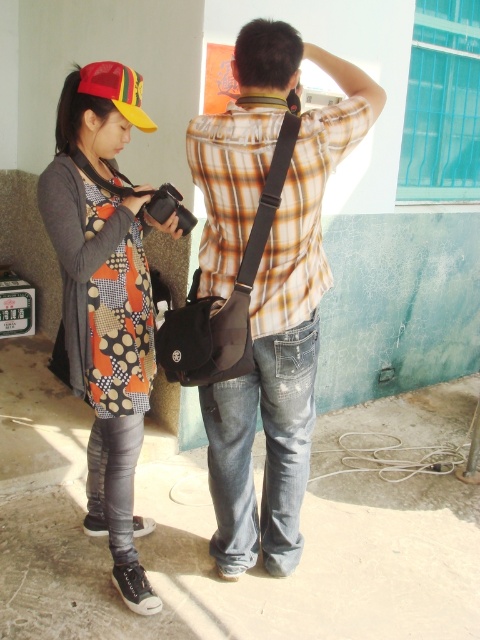
Question: Which object is the farthest from the matte patchwork dress at center?

Choices:
 (A) matte yellow baseball cap at upper left
 (B) plaid shirt at center

Answer: (A)

Question: Which is farther from the matte patchwork dress at center?

Choices:
 (A) matte yellow baseball cap at upper left
 (B) plaid shirt at center

Answer: (A)

Question: Does plaid shirt at center have a larger size compared to matte patchwork dress at center?

Choices:
 (A) yes
 (B) no

Answer: (A)

Question: Is plaid shirt at center in front of matte patchwork dress at center?

Choices:
 (A) no
 (B) yes

Answer: (B)

Question: Which of the following is the farthest from the observer?

Choices:
 (A) (127, 310)
 (B) (228, 268)

Answer: (A)

Question: Does matte patchwork dress at center appear under matte yellow baseball cap at upper left?

Choices:
 (A) yes
 (B) no

Answer: (A)